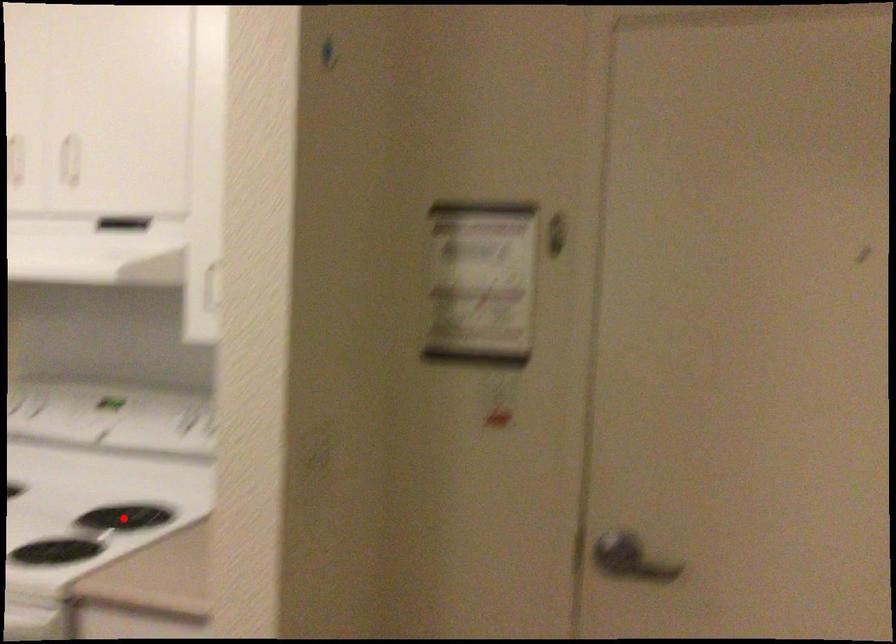
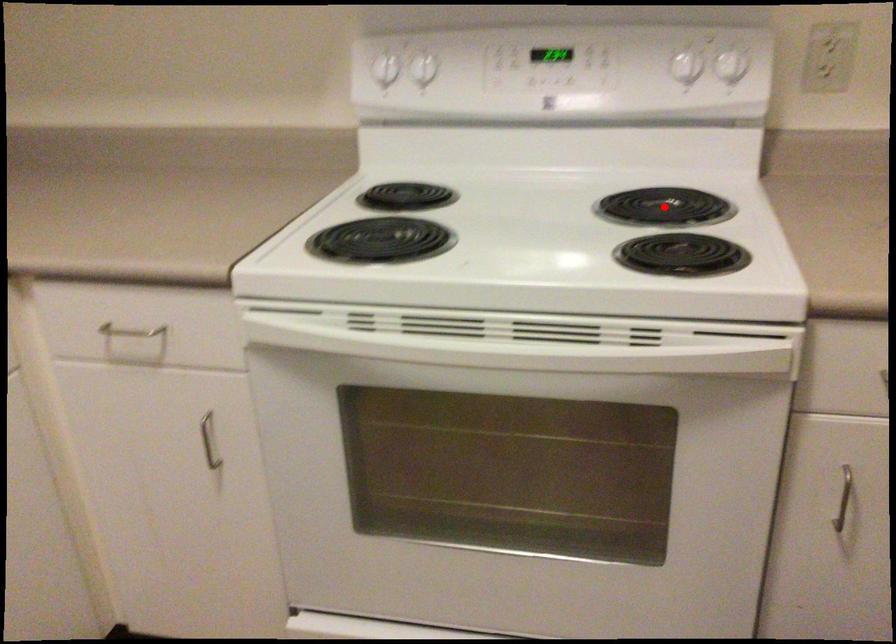
I am providing you with two images of the same scene from different viewpoints. A red point is marked on the first image and another point is marked on the second image. Are the points marked in image1 and image2 representing the same 3D position?

Yes